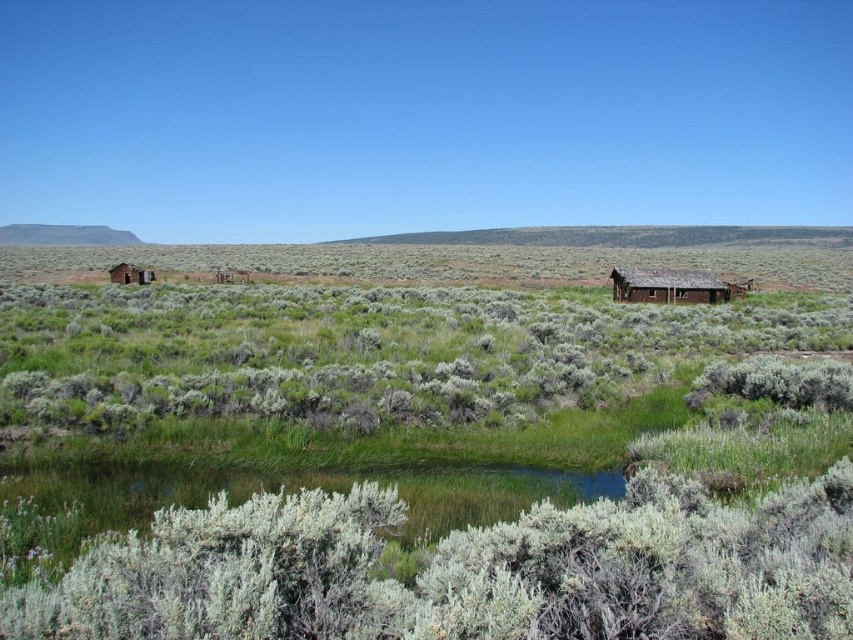
Is point (631, 276) farther from camera compared to point (137, 278)?

That is False.

Between weathered wood hut at right and rustic wooden hut at left, which one is positioned lower?

weathered wood hut at right is below.

Is point (717, 292) positioned before point (143, 275)?

Yes, point (717, 292) is in front of point (143, 275).

Where is `weathered wood hut at right`? This screenshot has height=640, width=853. weathered wood hut at right is located at coordinates (666, 285).